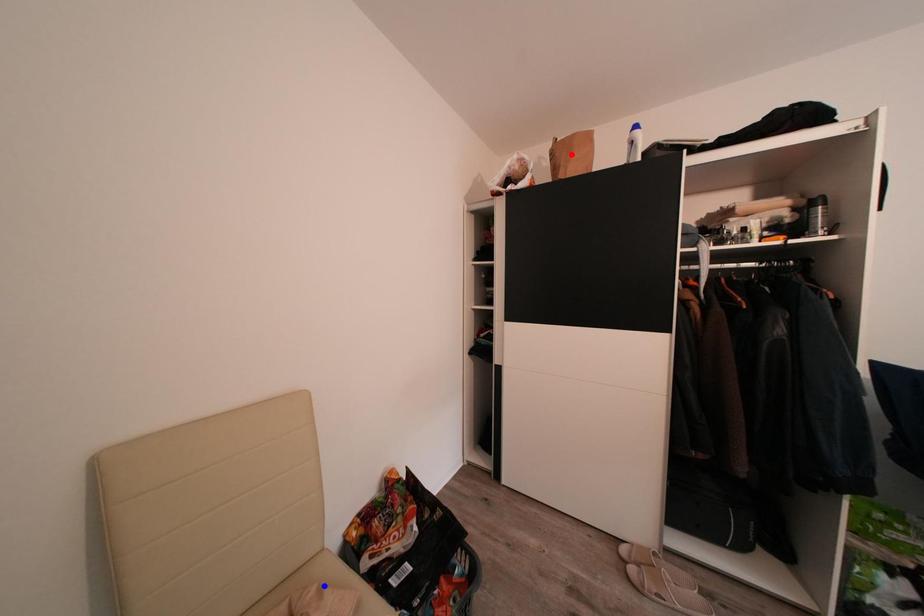
Question: Two points are marked on the image. Which point is closer to the camera?

Choices:
 (A) Blue point is closer.
 (B) Red point is closer.

Answer: (A)